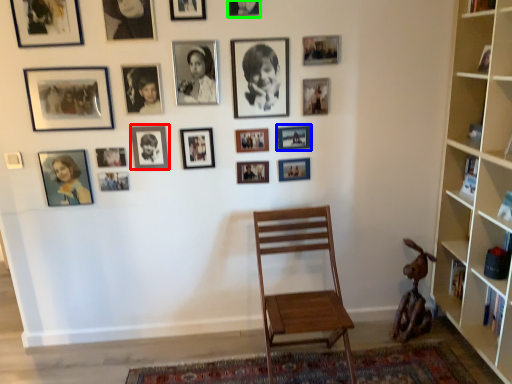
Question: Which object is the farthest from picture frame (highlighted by a red box)? Choose among these: picture frame (highlighted by a blue box) or picture frame (highlighted by a green box).

Choices:
 (A) picture frame
 (B) picture frame

Answer: (B)